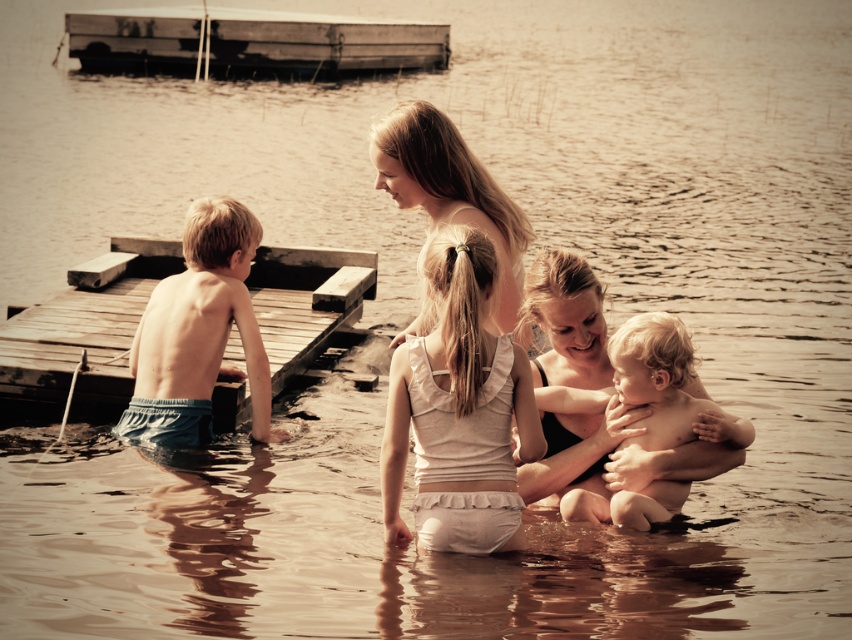
Question: From the image, what is the correct spatial relationship of wooden raft at upper left in relation to smooth skin baby at center?

Choices:
 (A) below
 (B) above

Answer: (B)

Question: Which object is farther from the camera taking this photo?

Choices:
 (A) smooth skin baby at center
 (B) wooden dock at left
 (C) blue denim shorts at left
 (D) smooth skin woman at center

Answer: (B)

Question: Can you confirm if blue denim shorts at left is thinner than wooden raft at upper left?

Choices:
 (A) yes
 (B) no

Answer: (A)

Question: Which object is the closest to the wooden dock at left?

Choices:
 (A) smooth skin baby at center
 (B) blue denim shorts at left
 (C) wooden raft at upper left
 (D) white cotton tank top at center

Answer: (B)

Question: Can you confirm if white cotton tank top at center is positioned to the left of wooden raft at upper left?

Choices:
 (A) yes
 (B) no

Answer: (B)

Question: Which of the following is the farthest from the observer?

Choices:
 (A) wooden raft at upper left
 (B) smooth skin baby at center
 (C) wooden dock at left
 (D) white cotton tank top at center

Answer: (A)